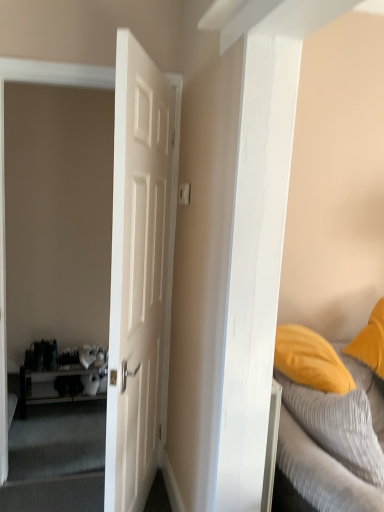
Find the location of a particular element. The height and width of the screenshot is (512, 384). free space above wooden shelf at left (from a real-world perspective) is located at coordinates (69, 354).